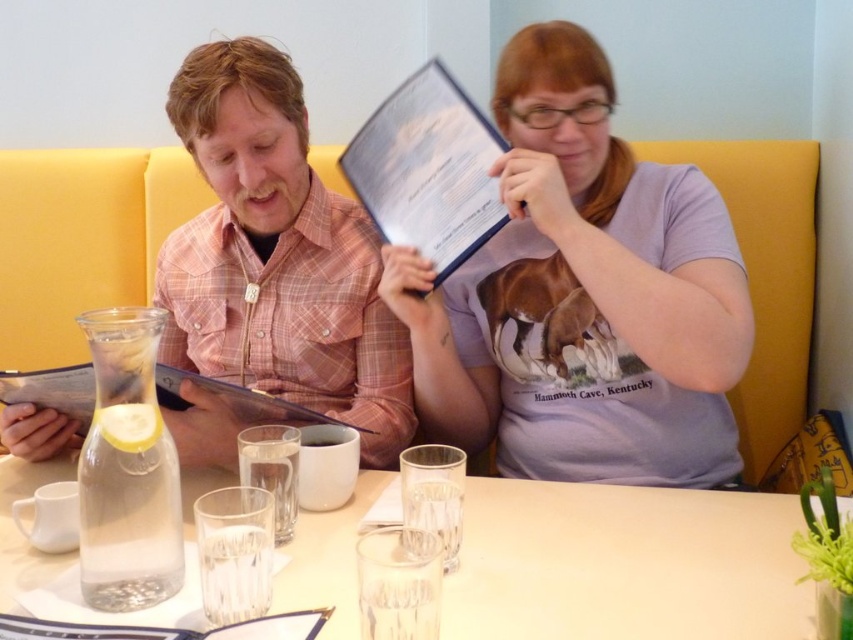
Based on the coordinates provided, which object is located at point (583, 296) in the image?

The point (583, 296) corresponds to the purple cotton shirt at upper right.

You are a server at a restaurant and need to take the order of the two customers. The purple cotton shirt at upper right is in front of pink plaid shirt at center. Which customer should you approach first according to proper restaurant etiquette?

According to proper restaurant etiquette, you should approach the customer wearing the pink plaid shirt at center first because the purple cotton shirt at upper right is in front of them, indicating they might be closer to the server or have a better vantage point for interaction.